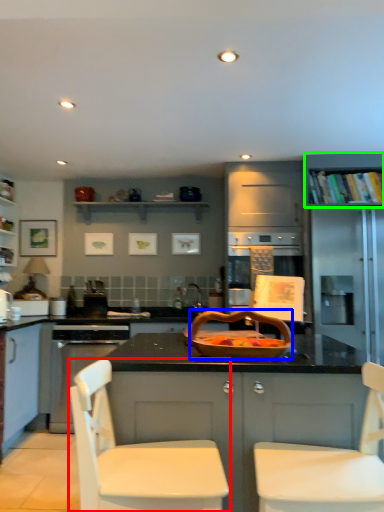
Question: Estimate the real-world distances between objects in this image. Which object is farther from chair (highlighted by a red box), basket (highlighted by a blue box) or shelf (highlighted by a green box)?

Choices:
 (A) basket
 (B) shelf

Answer: (B)